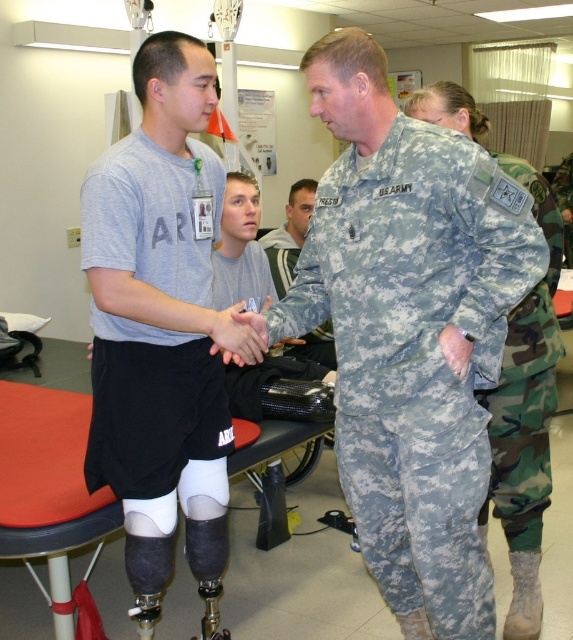
You are a physical therapist in this medical facility. You need to place two markers at specific coordinates to guide a patient through an exercise. The markers must be placed at point (189, 484) and point (300, 184). Which marker should you place first if you want to start from the closest point to the patient?

You should place the marker at point (189, 484) first because it is closer to the patient than point (300, 184).